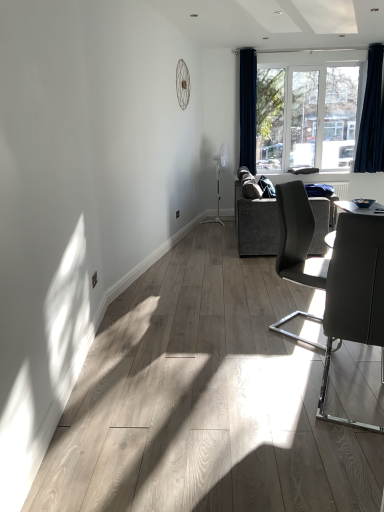
Locate an element on the screen. free space behind matte gray chair at center right, which appears as the second chair when viewed from the front is located at coordinates (278, 298).